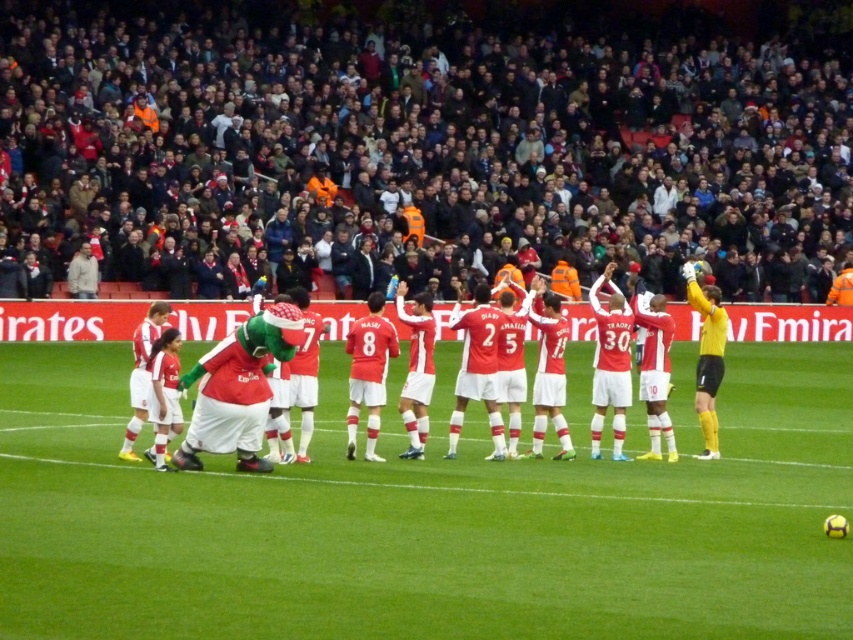
Which is above, dark gray concrete stadium at upper center or matte red jersey at center?

Positioned higher is dark gray concrete stadium at upper center.

Which of these two, dark gray concrete stadium at upper center or matte red jersey at center, stands taller?

Standing taller between the two is dark gray concrete stadium at upper center.

Locate an element on the screen. The height and width of the screenshot is (640, 853). dark gray concrete stadium at upper center is located at coordinates (418, 148).

The height and width of the screenshot is (640, 853). In order to click on dark gray concrete stadium at upper center in this screenshot , I will do `click(418, 148)`.

The height and width of the screenshot is (640, 853). I want to click on dark gray concrete stadium at upper center, so click(x=418, y=148).

Who is positioned more to the left, dark gray concrete stadium at upper center or green grass football field at center?

green grass football field at center is more to the left.

Who is more forward, (271, 232) or (740, 396)?

Point (740, 396)

At what (x,y) coordinates should I click in order to perform the action: click on dark gray concrete stadium at upper center. Please return your answer as a coordinate pair (x, y). The height and width of the screenshot is (640, 853). Looking at the image, I should click on (418, 148).

Can you confirm if green grass football field at center is smaller than matte red jersey at center?

Yes, green grass football field at center is smaller than matte red jersey at center.

Is green grass football field at center to the right of matte red jersey at center from the viewer's perspective?

Incorrect, green grass football field at center is not on the right side of matte red jersey at center.

The width and height of the screenshot is (853, 640). I want to click on green grass football field at center, so click(428, 518).